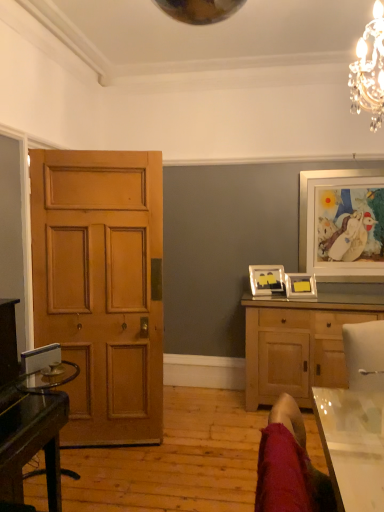
Find the location of a particular element. This screenshot has height=512, width=384. free space in front of metallic silver picture frame at center-right, the second picture frame in the left-to-right sequence is located at coordinates (306, 303).